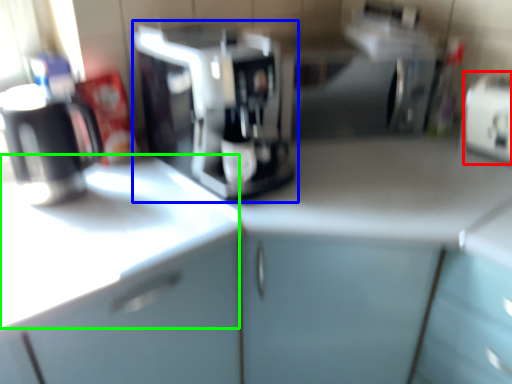
Question: Estimate the real-world distances between objects in this image. Which object is farther from appliance (highlighted by a red box), coffee maker (highlighted by a blue box) or counter top (highlighted by a green box)?

Choices:
 (A) coffee maker
 (B) counter top

Answer: (B)